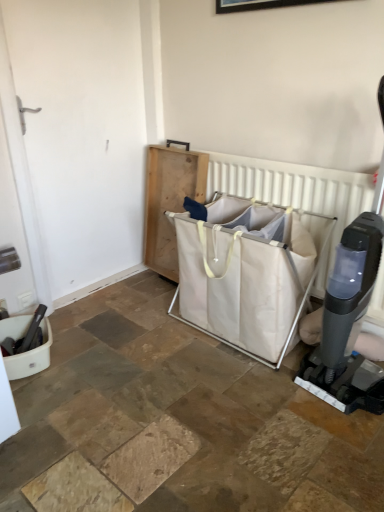
Question: Do you think white fabric laundry basket at center is within light brown wooden tray at center, or outside of it?

Choices:
 (A) inside
 (B) outside

Answer: (B)

Question: From a real-world perspective, is white fabric laundry basket at center positioned above or below light brown wooden tray at center?

Choices:
 (A) below
 (B) above

Answer: (A)

Question: Which is nearer to the light brown wooden tray at center?

Choices:
 (A) white fabric laundry basket at center
 (B) white fabric laundry basket at center

Answer: (B)

Question: Which object is positioned closest to the white fabric laundry basket at center?

Choices:
 (A) light brown wooden tray at center
 (B) white fabric laundry basket at center

Answer: (B)